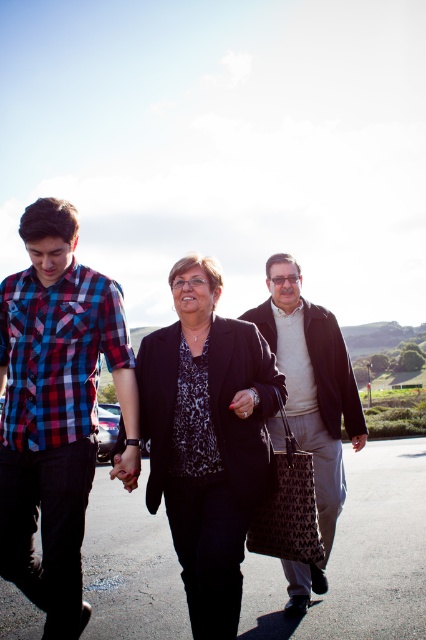
Consider the image. You are standing in front of the black fabric parking lot at center. The parking lot is 3.83 meters away from you. If you want to walk to the parking lot, how many steps would you need to take if each step is 0.75 meters long?

The black fabric parking lot at center is 3.83 meters away. Each step covers 0.75 meters, so dividing 3.83 by 0.75 gives approximately 5.1 steps. Since you can only take whole steps, you would need to take 6 steps to reach the parking lot.

You are a delivery person who needs to place a package on the ground near the black printed fabric bag at center. Considering the black fabric parking lot at center is below it, where should you place the package?

The black fabric parking lot at center is located below the black printed fabric bag at center, so you should place the package on the black fabric parking lot at center near the bag.